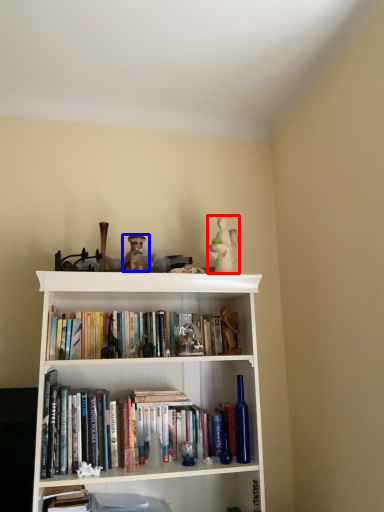
Question: Which point is further to the camera, toy (highlighted by a red box) or toy (highlighted by a blue box)?

Choices:
 (A) toy
 (B) toy

Answer: (A)